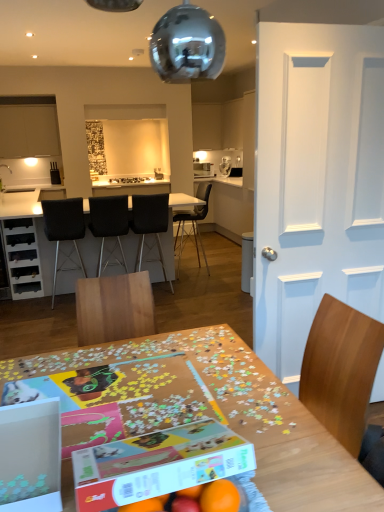
Question: From the image's perspective, would you say white cardboard box at center, placed as the 2th cardboard box when sorted from left to right, is positioned over white glossy table at center, placed as the first table when sorted from back to front?

Choices:
 (A) yes
 (B) no

Answer: (B)

Question: Considering the relative positions of white cardboard box at center, placed as the 2th cardboard box when sorted from left to right, and white glossy table at center, which ranks as the second table in bottom-to-top order, in the image provided, is white cardboard box at center, placed as the 2th cardboard box when sorted from left to right, to the left of white glossy table at center, which ranks as the second table in bottom-to-top order, from the viewer's perspective?

Choices:
 (A) yes
 (B) no

Answer: (B)

Question: From a real-world perspective, is white cardboard box at center, placed as the 2th cardboard box when sorted from left to right, located higher than white glossy table at center, the 2th table from the front?

Choices:
 (A) yes
 (B) no

Answer: (A)

Question: Does white cardboard box at center, placed as the 2th cardboard box when sorted from left to right, lie in front of white glossy table at center, which ranks as the second table in bottom-to-top order?

Choices:
 (A) yes
 (B) no

Answer: (A)

Question: Is white cardboard box at center, placed as the 2th cardboard box when sorted from left to right, facing away from white glossy table at center, the 2th table from the front?

Choices:
 (A) yes
 (B) no

Answer: (A)

Question: From a real-world perspective, is wooden puzzle table at center, the first table ordered from the bottom, physically located above or below black leather chair at center, the third chair in the right-to-left sequence?

Choices:
 (A) below
 (B) above

Answer: (A)

Question: Is wooden puzzle table at center, marked as the first table in a front-to-back arrangement, bigger or smaller than black leather chair at center, the third chair in the right-to-left sequence?

Choices:
 (A) small
 (B) big

Answer: (B)

Question: Looking at their shapes, would you say wooden puzzle table at center, marked as the second table in a top-to-bottom arrangement, is wider or thinner than black leather chair at center, the third chair in the right-to-left sequence?

Choices:
 (A) wide
 (B) thin

Answer: (A)

Question: Considering the positions of point (314, 421) and point (97, 275), is point (314, 421) closer or farther from the camera than point (97, 275)?

Choices:
 (A) closer
 (B) farther

Answer: (A)

Question: In terms of height, does white glossy table at center, the 2th table from the front, look taller or shorter compared to matte white cabinet at upper left?

Choices:
 (A) tall
 (B) short

Answer: (A)

Question: Considering their positions, is white glossy table at center, which ranks as the second table in bottom-to-top order, located in front of or behind matte white cabinet at upper left?

Choices:
 (A) behind
 (B) front

Answer: (B)

Question: In terms of size, does white glossy table at center, the 2th table from the front, appear bigger or smaller than matte white cabinet at upper left?

Choices:
 (A) small
 (B) big

Answer: (B)

Question: In terms of width, does white glossy table at center, placed as the first table when sorted from back to front, look wider or thinner when compared to matte white cabinet at upper left?

Choices:
 (A) thin
 (B) wide

Answer: (B)

Question: Considering the positions of matte white cabinet at upper left and white painted wood door at right in the image, is matte white cabinet at upper left bigger or smaller than white painted wood door at right?

Choices:
 (A) big
 (B) small

Answer: (B)

Question: Based on their positions, is matte white cabinet at upper left located to the left or right of white painted wood door at right?

Choices:
 (A) right
 (B) left

Answer: (B)